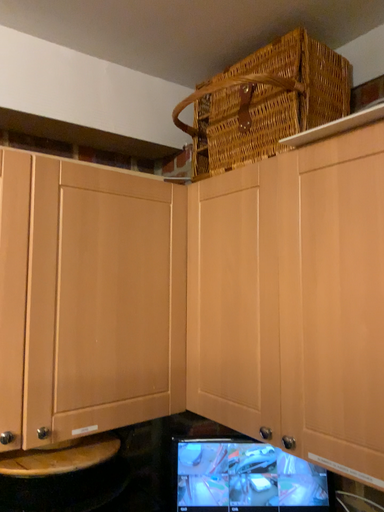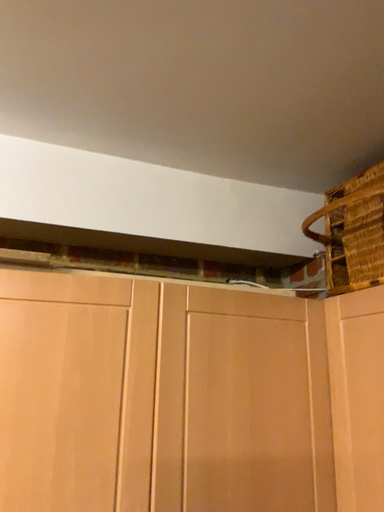
Question: How did the camera likely rotate when shooting the video?

Choices:
 (A) rotated left
 (B) rotated right

Answer: (A)